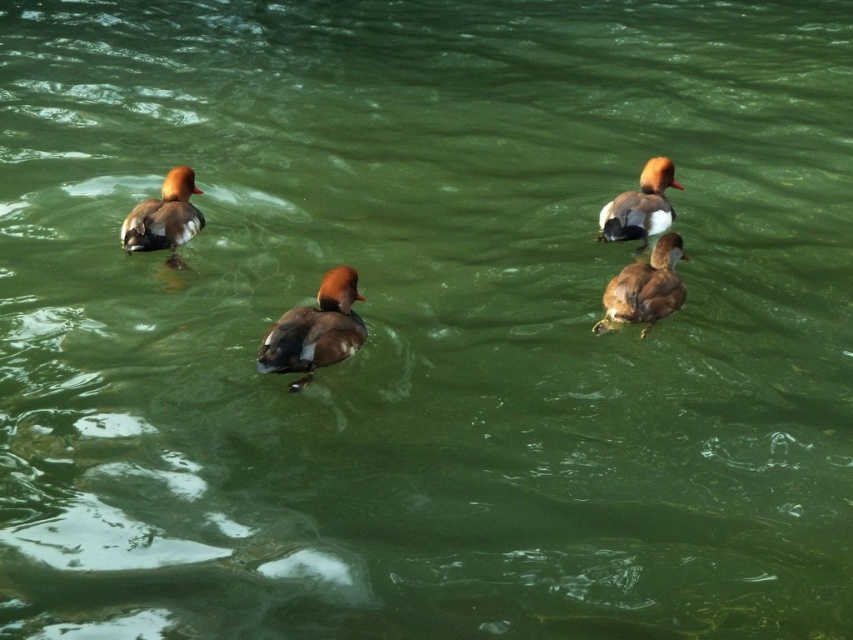
Question: From the image, what is the correct spatial relationship of brown glossy duck at center in relation to brown feathered duck at left?

Choices:
 (A) above
 (B) below

Answer: (B)

Question: Considering the real-world distances, which object is closest to the brown glossy duck at upper right?

Choices:
 (A) brown glossy duck at center
 (B) brown feathered duck at left

Answer: (A)

Question: Does brown matte duck at center appear under brown feathered duck at left?

Choices:
 (A) yes
 (B) no

Answer: (A)

Question: Estimate the real-world distances between objects in this image. Which object is closer to the brown glossy duck at upper right?

Choices:
 (A) brown matte duck at center
 (B) brown feathered duck at left

Answer: (A)

Question: Is brown feathered duck at left bigger than brown glossy duck at upper right?

Choices:
 (A) yes
 (B) no

Answer: (B)

Question: Which point is closer to the camera?

Choices:
 (A) brown matte duck at center
 (B) brown glossy duck at upper right
 (C) brown glossy duck at center

Answer: (C)